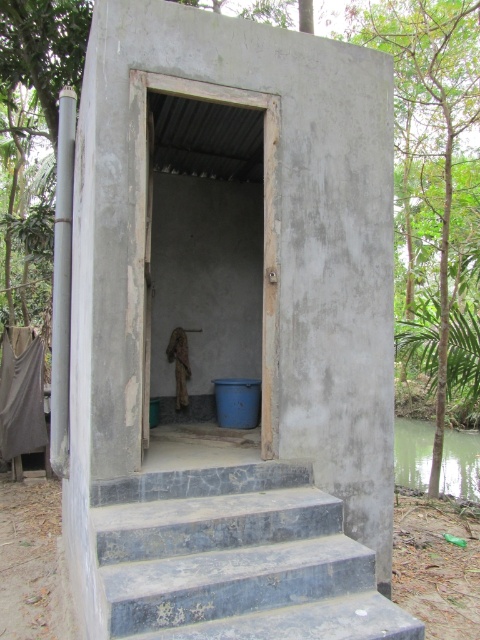
Between smooth concrete hut at center and dark gray concrete stairs at lower center, which one has more height?

smooth concrete hut at center is taller.

Which is behind, point (194, 435) or point (335, 602)?

The point (194, 435) is behind.

Between point (156, 132) and point (168, 636), which one is positioned in front?

Point (168, 636) is more forward.

Find the location of `smooth concrete hut at center`. smooth concrete hut at center is located at coordinates (230, 332).